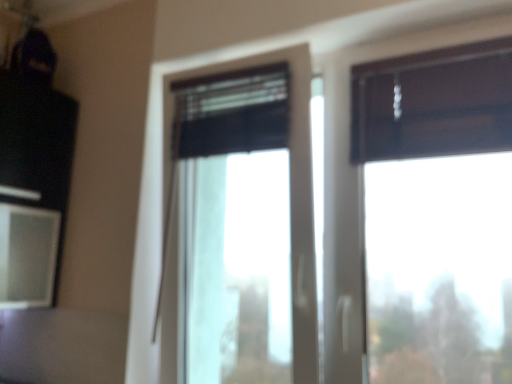
Question: From the image's perspective, is black matte window at center, which appears as the first window when viewed from the left, positioned above or below matte white screen at left?

Choices:
 (A) below
 (B) above

Answer: (B)

Question: Considering the positions of black matte window at center, which appears as the first window when viewed from the left, and matte white screen at left in the image, is black matte window at center, which appears as the first window when viewed from the left, bigger or smaller than matte white screen at left?

Choices:
 (A) small
 (B) big

Answer: (B)

Question: Which object is positioned farthest from the dark wood window at upper right, which appears as the first window when viewed from the right?

Choices:
 (A) matte white screen at left
 (B) black matte window at center, which appears as the first window when viewed from the left

Answer: (A)

Question: Which object is positioned farthest from the dark wood window at upper right, which appears as the first window when viewed from the right?

Choices:
 (A) black matte window at center, which appears as the first window when viewed from the left
 (B) matte white screen at left

Answer: (B)